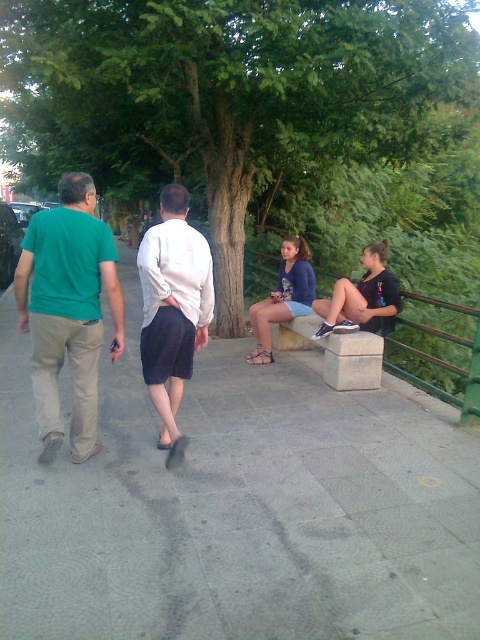
Question: Which of the following is the closest to the observer?

Choices:
 (A) (120, 426)
 (B) (108, 26)
 (C) (265, 362)
 (D) (64, 252)

Answer: (D)

Question: Is green leafy tree at center bigger than green matte shirt at left?

Choices:
 (A) yes
 (B) no

Answer: (A)

Question: Is blue denim shorts at center positioned before brown leather sandal at center?

Choices:
 (A) yes
 (B) no

Answer: (A)

Question: Which point is closer to the camera?

Choices:
 (A) gray concrete pavement at center
 (B) green leafy tree at center
 (C) white matte shirt at center
 (D) black matte shorts at lower right

Answer: (A)

Question: Which point is closer to the camera?

Choices:
 (A) black matte shorts at lower right
 (B) green leafy tree at center
 (C) white matte shirt at center
 (D) gray concrete pavement at center

Answer: (D)

Question: Is blue denim shorts at center bigger than brown leather sandal at center?

Choices:
 (A) yes
 (B) no

Answer: (A)